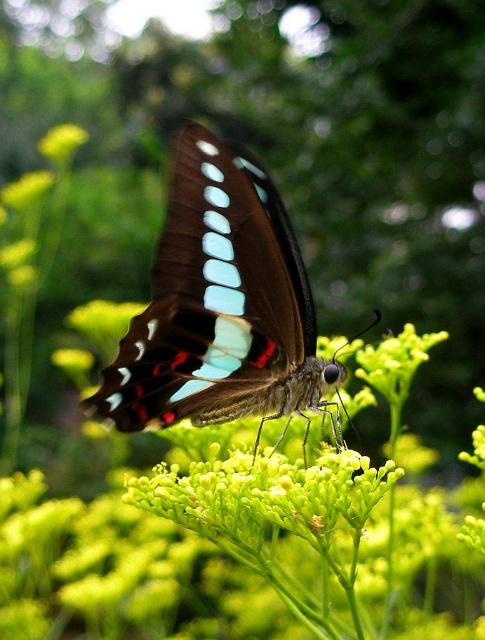
You are a photographer trying to capture the shiny brown butterfly at center and the green matte flower at upper left in a single frame. Based on their sizes, which one would appear more prominent in the photo?

The shiny brown butterfly at center is larger in size than the green matte flower at upper left, so it would appear more prominent in the photo.

You are a photographer aiming to capture the shiny brown butterfly at center. The camera focuses on the point at coordinates point (220,307). Will the butterfly be in focus?

The shiny brown butterfly at center is located at point (220,307), so yes, the butterfly will be in focus because the camera is focusing on that exact point.

You are a photographer aiming to capture the shiny brown butterfly at center. According to the coordinates provided, where should you focus your camera to ensure the butterfly is centered in your shot?

The shiny brown butterfly at center is positioned at coordinates point (220, 307), so you should focus your camera at that point to center it in your shot.